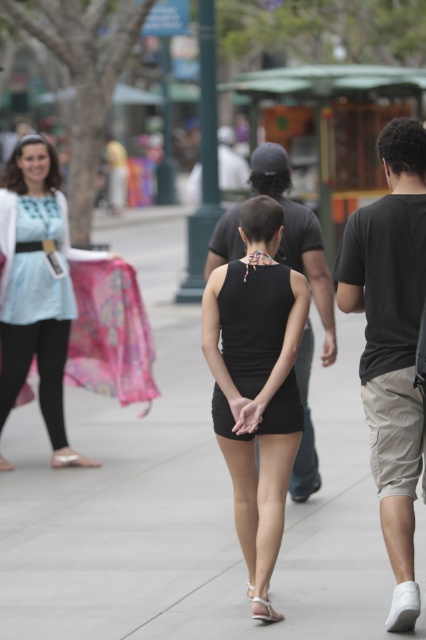
You are standing in the pedestrian area and see the matte blue dress at left and the matte black hand at center. Which object is positioned more to the left side of the scene?

The matte blue dress at left is positioned more to the left side of the scene than the matte black hand at center.